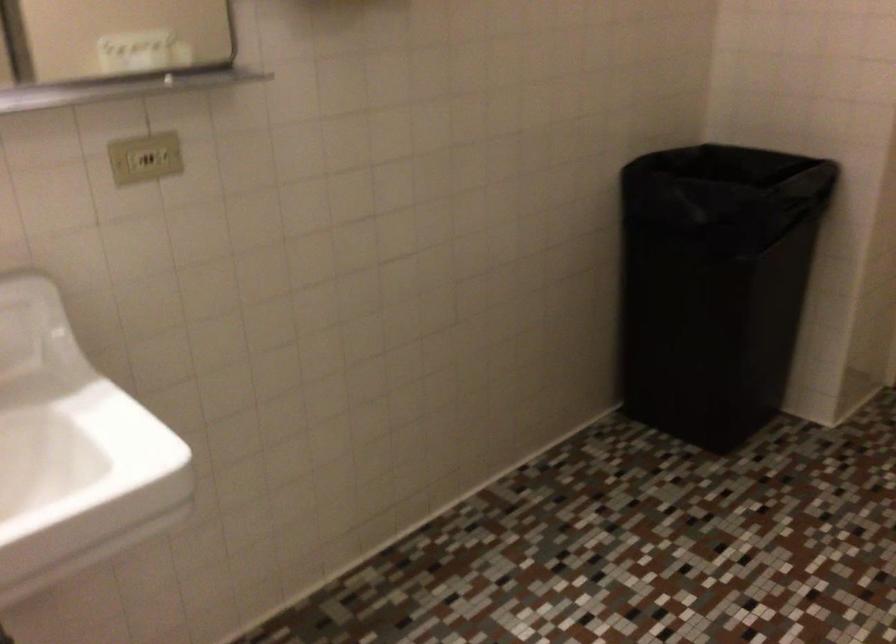
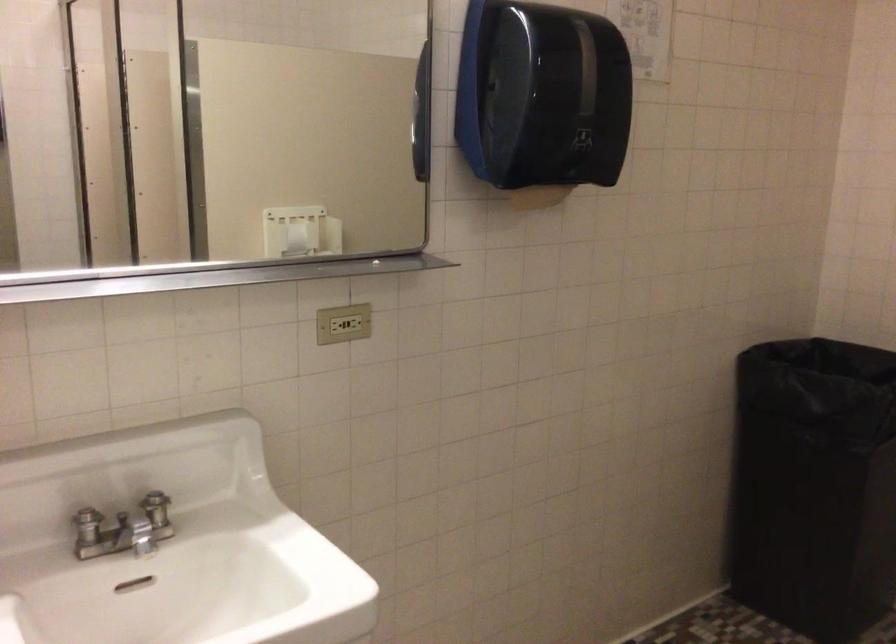
In the second image, find the point that corresponds to [151,162] in the first image.

(342, 323)